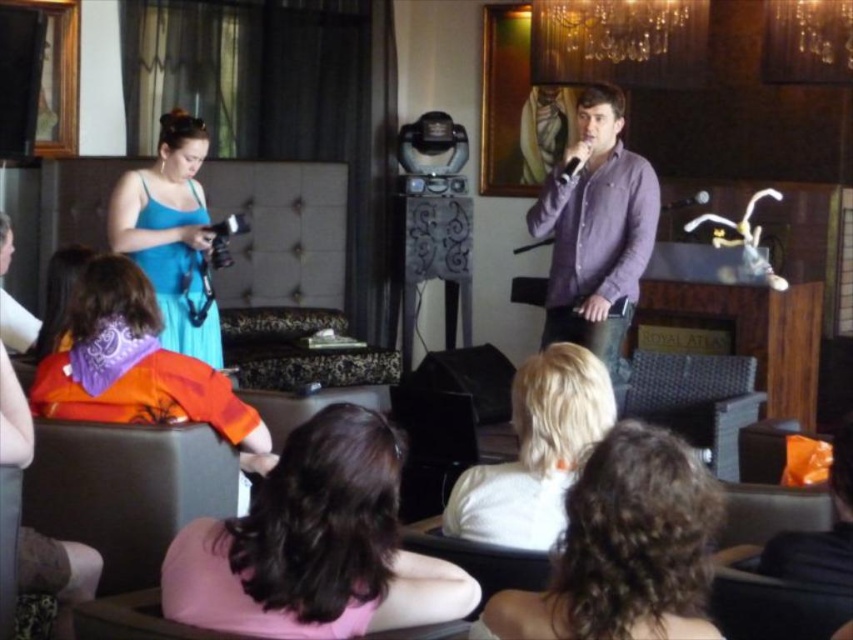
Who is shorter, purple bandana at center or matte black speaker at center?

With less height is matte black speaker at center.

Who is more distant from viewer, (247, 416) or (434, 376)?

Positioned behind is point (434, 376).

Locate an element on the screen. The height and width of the screenshot is (640, 853). purple bandana at center is located at coordinates [134, 364].

Can you confirm if white matte hair at center is bigger than matte blue dress at left?

Actually, white matte hair at center might be smaller than matte blue dress at left.

Is point (569, 422) positioned before point (199, 339)?

Yes, it is.

The image size is (853, 640). I want to click on white matte hair at center, so [x=537, y=452].

Is dark brown hair at center thinner than matte black speaker at center?

Yes.

Is dark brown hair at center positioned behind matte black speaker at center?

That is False.

The width and height of the screenshot is (853, 640). Find the location of `dark brown hair at center`. dark brown hair at center is located at coordinates (315, 545).

I want to click on dark brown hair at center, so click(x=315, y=545).